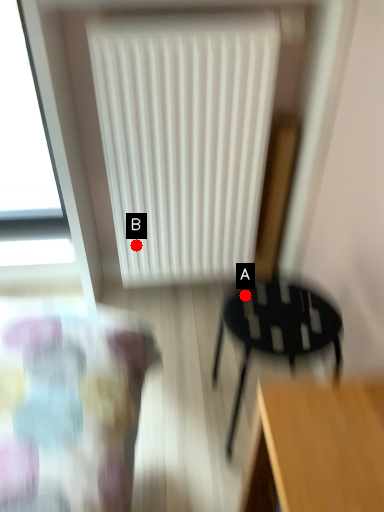
Question: Two points are circled on the image, labeled by A and B beside each circle. Which point appears closest to the camera in this image?

Choices:
 (A) A is closer
 (B) B is closer

Answer: (A)